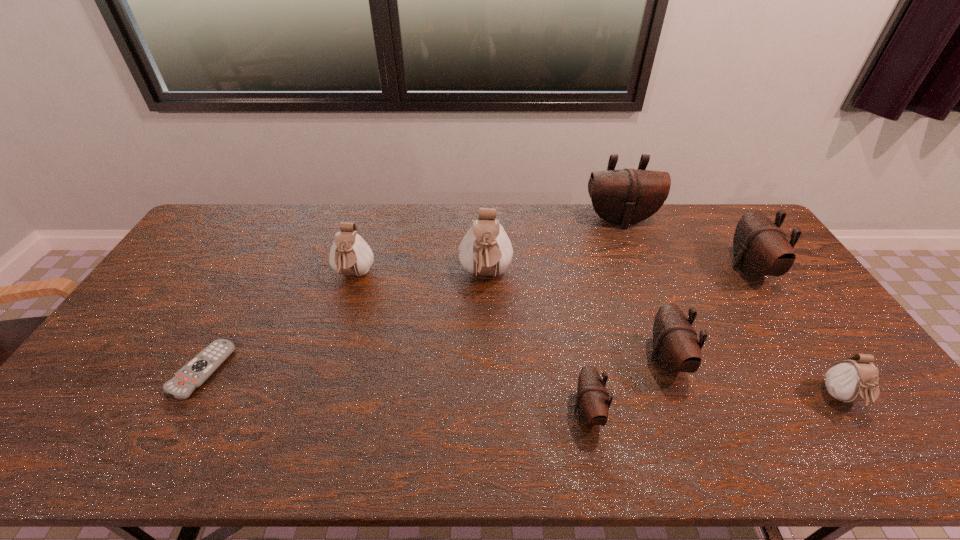
This screenshot has height=540, width=960. I want to click on unoccupied position between the rightmost white pouch and the third biggest brown pouch, so click(x=755, y=379).

The image size is (960, 540). In order to click on vacant area that lies between the second smallest white pouch and the nearest white pouch in this screenshot , I will do (x=598, y=337).

You are a GUI agent. You are given a task and a screenshot of the screen. Output one action in this format:
    pyautogui.click(x=<x>, y=<y>)
    Task: Click on the free spot between the second white pouch from right to left and the remote control
    The height and width of the screenshot is (540, 960).
    Given the screenshot: What is the action you would take?
    pyautogui.click(x=344, y=323)

Locate an element on the screen. Image resolution: width=960 pixels, height=540 pixels. empty space between the biggest brown pouch and the third smallest brown pouch is located at coordinates (684, 245).

Choose which object is the seventh nearest neighbor to the remote control. Please provide its 2D coordinates. Your answer should be formatted as a tuple, i.e. [(x, y)], where the tuple contains the x and y coordinates of a point satisfying the conditions above.

[(852, 380)]

Identify the location of the closest object to the second farthest brown pouch. (624, 197).

Identify which pouch is the second nearest to the third smallest brown pouch. Please provide its 2D coordinates. Your answer should be formatted as a tuple, i.e. [(x, y)], where the tuple contains the x and y coordinates of a point satisfying the conditions above.

[(852, 380)]

Where is `pouch that can be found as the seventh closest to the remote control`? pouch that can be found as the seventh closest to the remote control is located at coordinates (x=852, y=380).

Identify the location of brown pouch that is the fourth closest to the shortest object. (760, 248).

Image resolution: width=960 pixels, height=540 pixels. In order to click on brown pouch that can be found as the closest to the rightmost white pouch in this screenshot , I will do `click(676, 348)`.